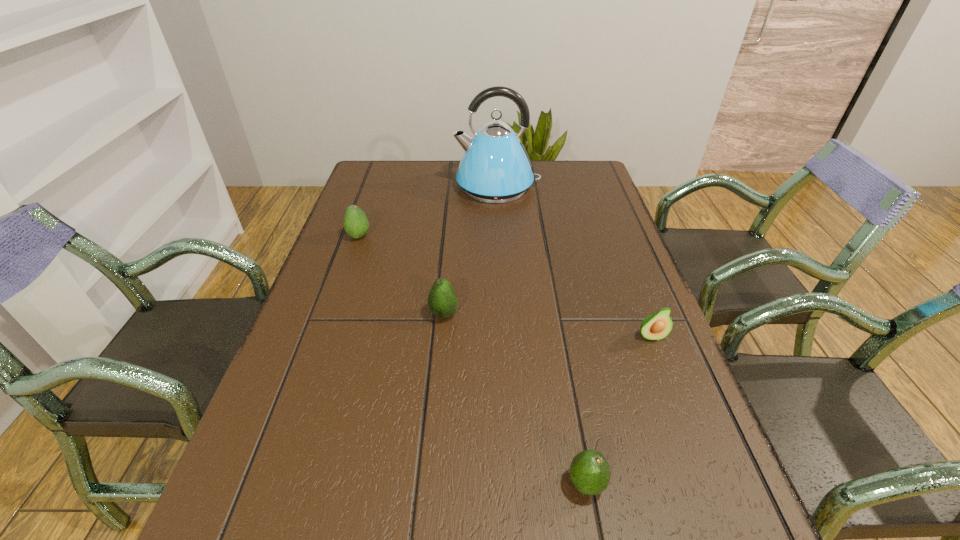
Image resolution: width=960 pixels, height=540 pixels. I want to click on free space located 0.170m at the spout of the tallest object, so click(403, 186).

Image resolution: width=960 pixels, height=540 pixels. In order to click on vacant space situated 0.190m at the spout of the tallest object in this screenshot , I will do `click(397, 186)`.

The height and width of the screenshot is (540, 960). In order to click on free spot located 0.140m at the spout of the tallest object in this screenshot , I will do `click(413, 186)`.

At what (x,y) coordinates should I click in order to perform the action: click on vacant space located on the front of the leftmost object. Please return your answer as a coordinate pair (x, y). Looking at the image, I should click on (324, 334).

Identify the location of vacant point located on the left of the third nearest avocado. The width and height of the screenshot is (960, 540). (307, 314).

This screenshot has width=960, height=540. What are the coordinates of `vacant space located on the cut side of the second nearest object` in the screenshot? It's located at (665, 374).

Find the location of `blank space located on the right of the third avocado from left to right`. blank space located on the right of the third avocado from left to right is located at coordinates (709, 483).

Find the location of a particular element. Image resolution: width=960 pixels, height=540 pixels. object at the far edge is located at coordinates (495, 168).

The width and height of the screenshot is (960, 540). Identify the location of object located in the left edge section of the desktop. (356, 224).

Locate an element on the screen. The image size is (960, 540). object located in the right edge section of the desktop is located at coordinates (657, 326).